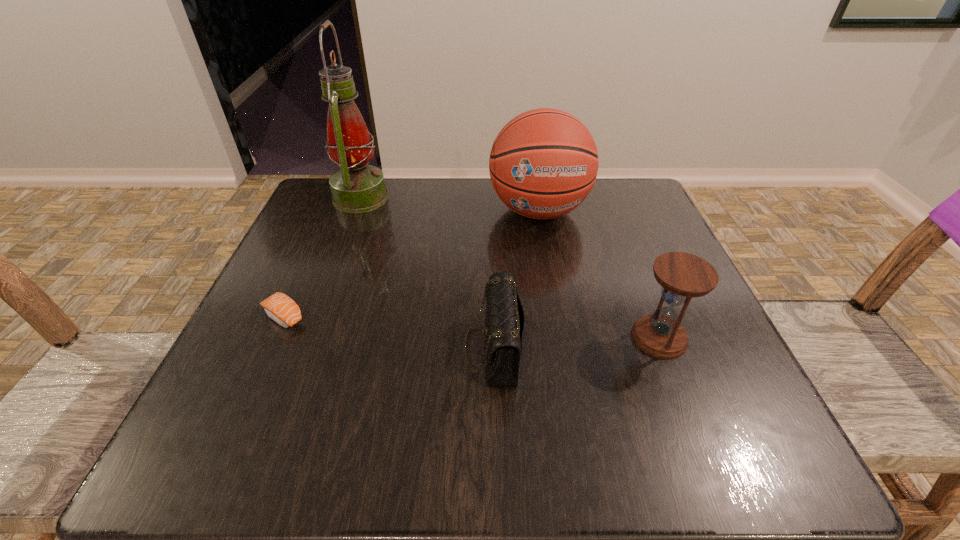
Identify the location of oil lamp. The height and width of the screenshot is (540, 960). (357, 187).

Find the location of a particular element. The image size is (960, 540). basketball is located at coordinates (543, 163).

You are a GUI agent. You are given a task and a screenshot of the screen. Output one action in this format:
    pyautogui.click(x=<x>, y=<y>)
    Task: Click on the third tallest object
    This screenshot has height=540, width=960.
    Given the screenshot: What is the action you would take?
    pyautogui.click(x=682, y=276)

Image resolution: width=960 pixels, height=540 pixels. I want to click on hourglass, so click(682, 276).

Image resolution: width=960 pixels, height=540 pixels. I want to click on clutch bag, so click(x=505, y=320).

You are a GUI agent. You are given a task and a screenshot of the screen. Output one action in this format:
    pyautogui.click(x=<x>, y=<y>)
    Task: Click on the shortest object
    This screenshot has height=540, width=960.
    Given the screenshot: What is the action you would take?
    279,307

Identify the location of vacant space situated on the front of the oil lamp. Image resolution: width=960 pixels, height=540 pixels. (331, 275).

You are a GUI agent. You are given a task and a screenshot of the screen. Output one action in this format:
    pyautogui.click(x=<x>, y=<y>)
    Task: Click on the free location located 0.380m on the logo side of the fourth shortest object
    This screenshot has height=540, width=960.
    Given the screenshot: What is the action you would take?
    click(x=572, y=401)

At what (x,y) coordinates should I click in order to perform the action: click on blank space located on the left of the rightmost object. Please return your answer as a coordinate pair (x, y). Looking at the image, I should click on (479, 338).

At what (x,y) coordinates should I click in order to perform the action: click on vacant space located on the front flap of the clutch bag. Please return your answer as a coordinate pair (x, y). Looking at the image, I should click on (409, 348).